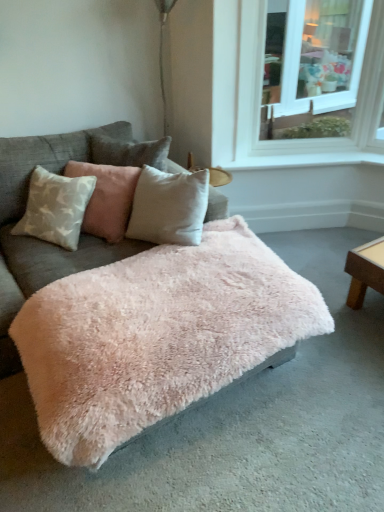
Question: Considering the relative sizes of velvet beige pillow at center and white smooth window sill at upper right in the image provided, is velvet beige pillow at center taller than white smooth window sill at upper right?

Choices:
 (A) yes
 (B) no

Answer: (A)

Question: Would you say velvet beige pillow at center is outside white smooth window sill at upper right?

Choices:
 (A) no
 (B) yes

Answer: (B)

Question: Is velvet beige pillow at center to the right of white smooth window sill at upper right from the viewer's perspective?

Choices:
 (A) yes
 (B) no

Answer: (B)

Question: Does velvet beige pillow at center have a greater width compared to white smooth window sill at upper right?

Choices:
 (A) no
 (B) yes

Answer: (B)

Question: Is white smooth window sill at upper right at the back of velvet beige pillow at center?

Choices:
 (A) no
 (B) yes

Answer: (A)

Question: From a real-world perspective, is velvet beige pillow at center located higher than white smooth window sill at upper right?

Choices:
 (A) no
 (B) yes

Answer: (B)

Question: Would you say fuzzy pink blanket at center is part of velvet beige pillow at center's contents?

Choices:
 (A) no
 (B) yes

Answer: (A)

Question: Is velvet beige pillow at center next to fuzzy pink blanket at center?

Choices:
 (A) yes
 (B) no

Answer: (B)

Question: From a real-world perspective, is velvet beige pillow at center on fuzzy pink blanket at center?

Choices:
 (A) yes
 (B) no

Answer: (A)

Question: Is velvet beige pillow at center oriented towards fuzzy pink blanket at center?

Choices:
 (A) no
 (B) yes

Answer: (B)

Question: Can you confirm if velvet beige pillow at center is positioned to the right of fuzzy pink blanket at center?

Choices:
 (A) yes
 (B) no

Answer: (A)

Question: Is velvet beige pillow at center located outside fuzzy pink blanket at center?

Choices:
 (A) yes
 (B) no

Answer: (B)

Question: Could fuzzy pink blanket at center be considered to be inside fuzzy pink ottoman at center?

Choices:
 (A) no
 (B) yes

Answer: (A)